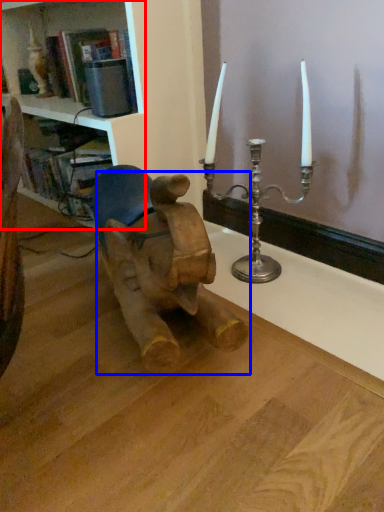
Question: Which object is closer to the camera taking this photo, shelf (highlighted by a red box) or baby elephant (highlighted by a blue box)?

Choices:
 (A) shelf
 (B) baby elephant

Answer: (B)